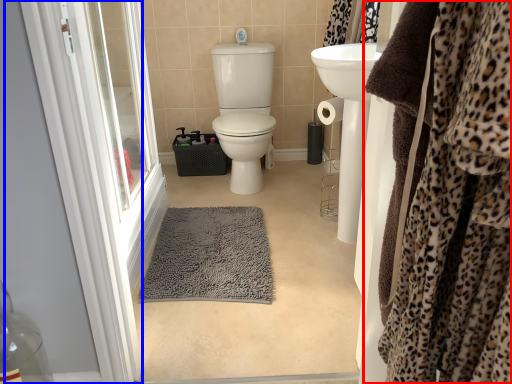
Question: Which of the following is the farthest to the observer, clothing (highlighted by a red box) or screen door (highlighted by a blue box)?

Choices:
 (A) clothing
 (B) screen door

Answer: (B)